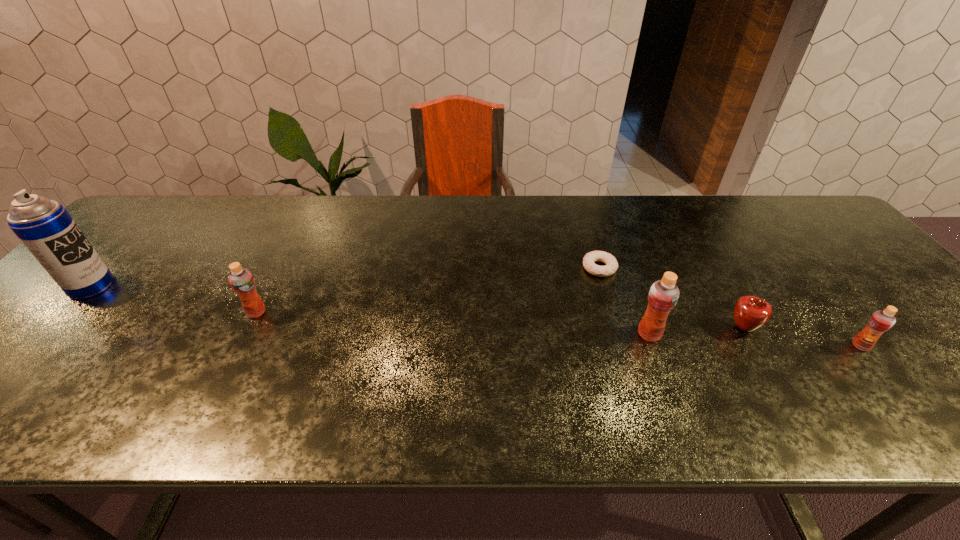
Locate an element on the screen. vacant space that satisfies the following two spatial constraints: 1. on the front side of the second object from left to right; 2. on the left side of the rightmost object is located at coordinates [239, 346].